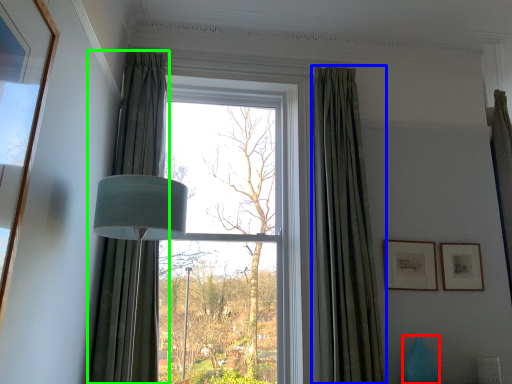
Question: Estimate the real-world distances between objects in this image. Which object is closer to vase (highlighted by a red box), curtain (highlighted by a blue box) or curtain (highlighted by a green box)?

Choices:
 (A) curtain
 (B) curtain

Answer: (A)